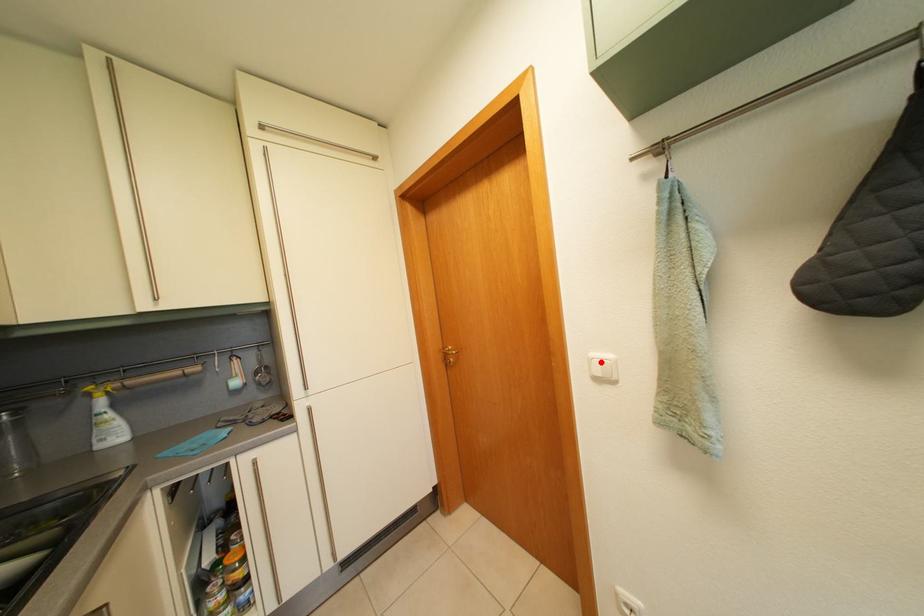
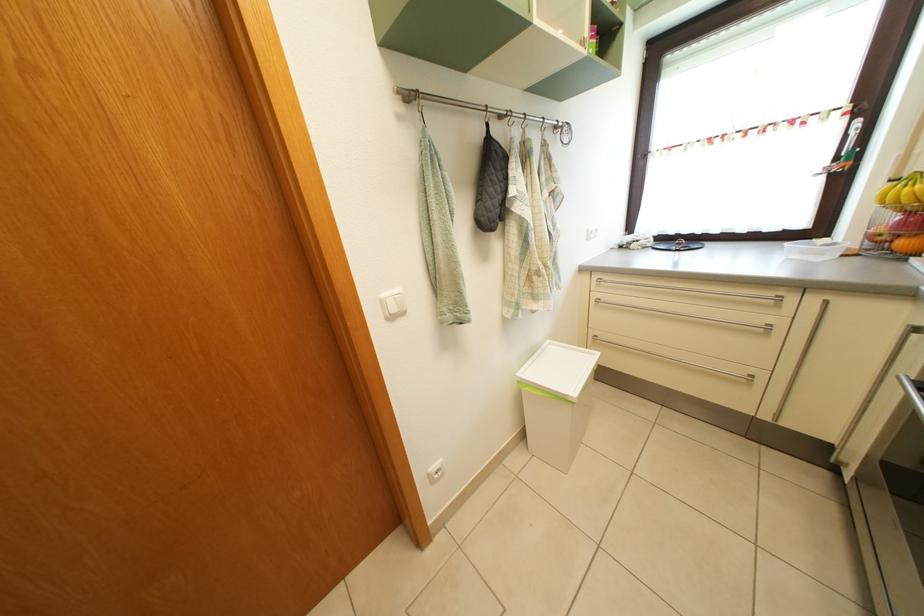
In the second image, find the point that corresponds to the highlighted location in the first image.

(392, 302)